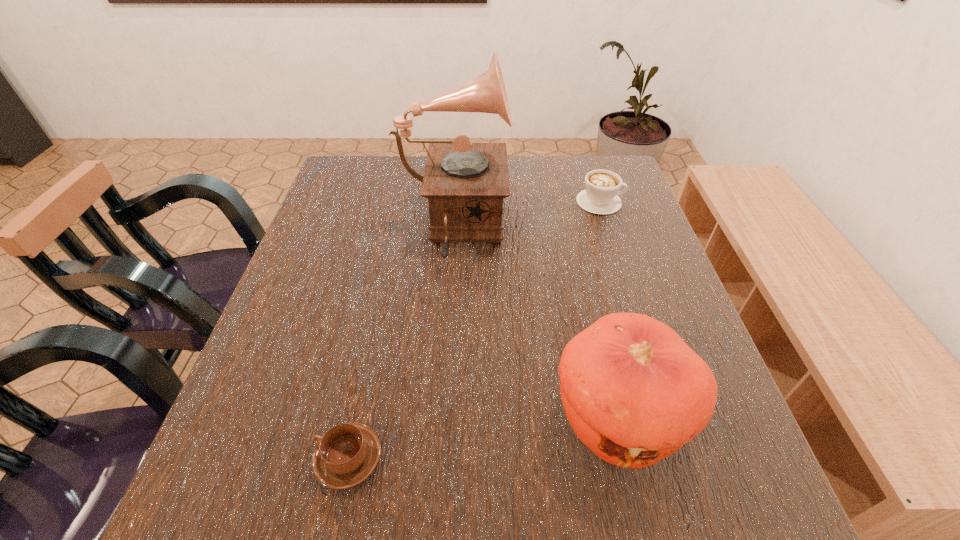
You are a GUI agent. You are given a task and a screenshot of the screen. Output one action in this format:
    pyautogui.click(x=<x>, y=<y>)
    Task: Click on the vacant space at the near edge
    The height and width of the screenshot is (540, 960).
    Given the screenshot: What is the action you would take?
    pyautogui.click(x=386, y=536)

In the image, there is a desktop. Where is `free space at the left edge`? free space at the left edge is located at coordinates (331, 305).

Where is `free space at the right edge`? This screenshot has height=540, width=960. free space at the right edge is located at coordinates (737, 466).

The height and width of the screenshot is (540, 960). In the image, there is a desktop. Find the location of `vacant space at the far left corner`. vacant space at the far left corner is located at coordinates (378, 172).

In the image, there is a desktop. Where is `vacant area at the near left corner`? vacant area at the near left corner is located at coordinates click(x=219, y=525).

In the image, there is a desktop. At what (x,y) coordinates should I click in order to perform the action: click on vacant space at the far right corner. Please return your answer as a coordinate pair (x, y). Looking at the image, I should click on (581, 185).

The width and height of the screenshot is (960, 540). I want to click on free space at the near right corner, so click(749, 487).

In order to click on empty location between the record player and the nearer cappuccino in this screenshot , I will do `click(400, 345)`.

The width and height of the screenshot is (960, 540). What are the coordinates of `unoccupied area between the shorter cappuccino and the third tallest object` in the screenshot? It's located at coord(474,330).

At what (x,y) coordinates should I click in order to perform the action: click on free spot between the farther cappuccino and the nearer cappuccino. Please return your answer as a coordinate pair (x, y). Looking at the image, I should click on (474, 330).